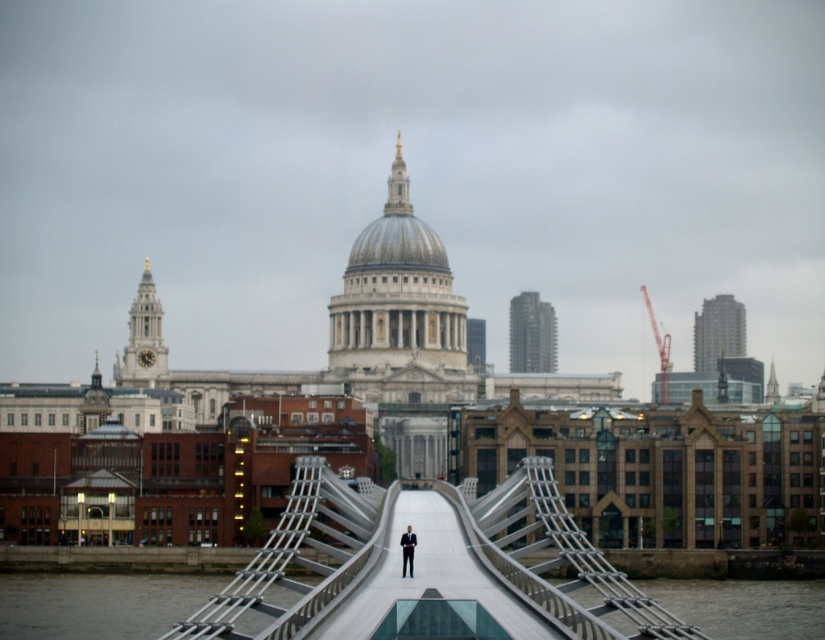
Question: Considering the relative positions of smooth concrete bridge at center and dark suit at center in the image provided, where is smooth concrete bridge at center located with respect to dark suit at center?

Choices:
 (A) left
 (B) right

Answer: (B)

Question: Estimate the real-world distances between objects in this image. Which object is farther from the dark suit at center?

Choices:
 (A) smooth concrete bridge at center
 (B) metallic silver suspension bridge at center

Answer: (B)

Question: Among these points, which one is nearest to the camera?

Choices:
 (A) (507, 632)
 (B) (495, 596)
 (C) (409, 560)

Answer: (A)

Question: Is metallic silver suspension bridge at center wider than dark suit at center?

Choices:
 (A) yes
 (B) no

Answer: (A)

Question: Which is farther from the smooth concrete bridge at center?

Choices:
 (A) dark suit at center
 (B) metallic silver suspension bridge at center

Answer: (A)

Question: Is metallic silver suspension bridge at center wider than dark suit at center?

Choices:
 (A) no
 (B) yes

Answer: (B)